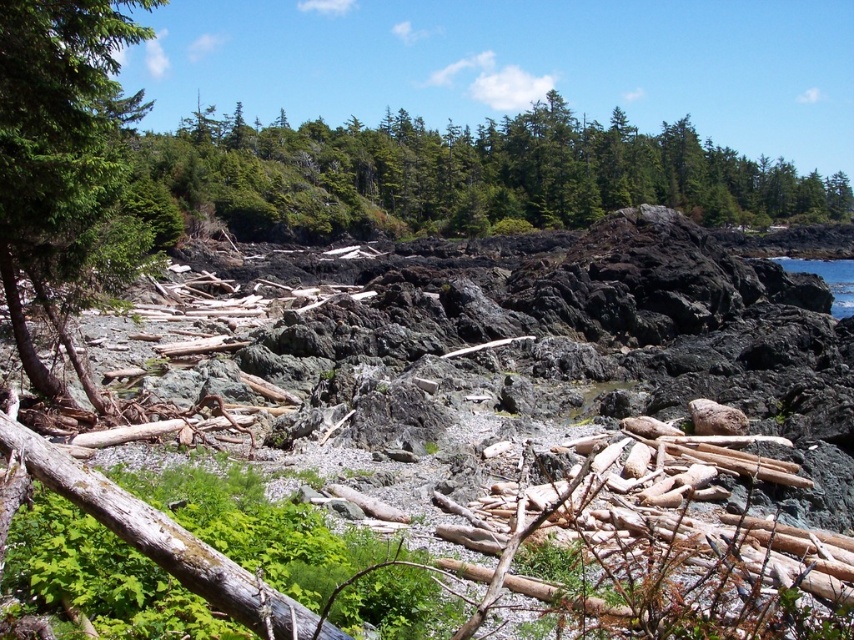
You are standing on the rugged coastal landscape and want to walk from the green matte tree at left to the blue water at upper right. Which direction should you head?

You should head to the right because the green matte tree at left is to the left of the blue water at upper right, so moving right will take you towards the blue water at upper right.

Looking at this image, you are standing at the base of the cliff and want to reach the green textured trees at upper center. Given that the average human walking speed is 3 feet per second, how many seconds would it take to reach the trees if you walk directly towards them?

The green textured trees at upper center are 140.12 feet away from the viewer. At an average walking speed of 3 feet per second, it would take approximately 46.7 seconds to reach them.

You are standing at the edge of the coastal landscape and want to place a small flag exactly at the center of the image. Is the black rock at center closer to the flag or to the shoreline?

The black rock at center is located at point [611,380], which is closer to the shoreline than the center of the image. Therefore, the black rock at center is closer to the shoreline.